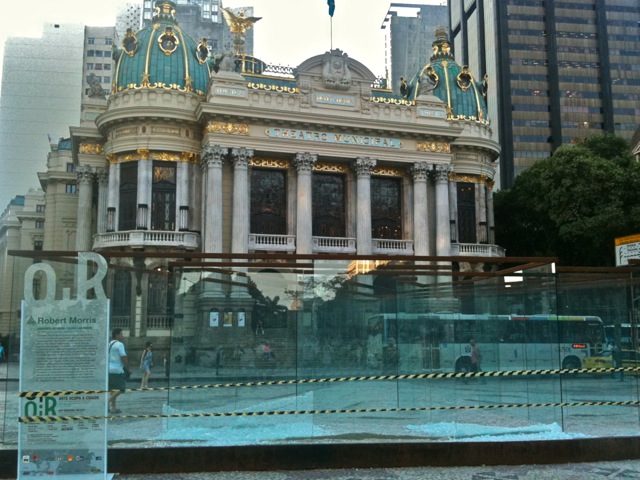
This screenshot has height=480, width=640. I want to click on white columns, so click(x=305, y=200).